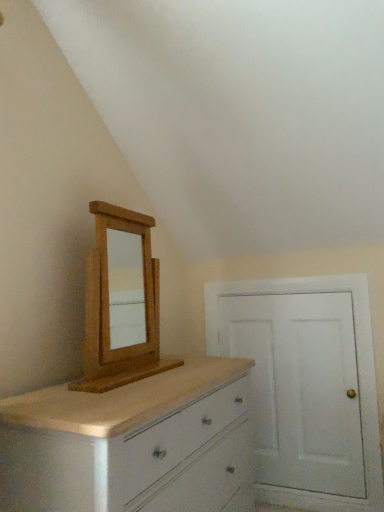
Where is `vacant space underneath light brown wood medicine cabinet at upper left (from a real-world perspective)`? This screenshot has height=512, width=384. vacant space underneath light brown wood medicine cabinet at upper left (from a real-world perspective) is located at coordinates (142, 371).